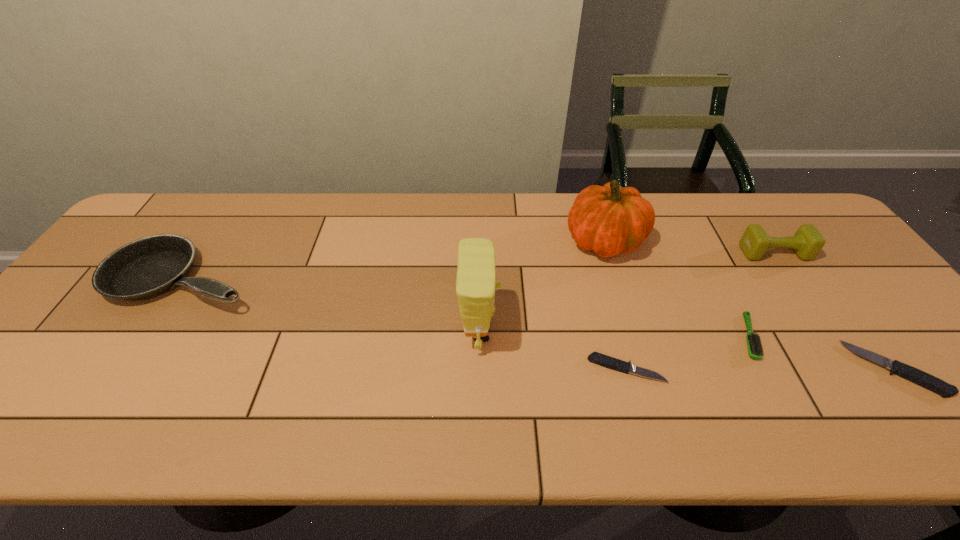
I want to click on free spot between the third object from right to left and the taller steak knife, so click(821, 353).

In order to click on unoccupied position between the pumpkin and the hairbrush in this screenshot , I will do `click(677, 289)`.

Locate an element on the screen. This screenshot has height=540, width=960. free space between the dumbbell and the hairbrush is located at coordinates (761, 295).

Locate an element on the screen. This screenshot has height=540, width=960. free space between the right steak knife and the fifth object from left to right is located at coordinates (821, 353).

The width and height of the screenshot is (960, 540). What are the coordinates of `vacant space in between the pumpkin and the fifth object from left to right` in the screenshot? It's located at (677, 289).

At what (x,y) coordinates should I click in order to perform the action: click on the closest object to the pumpkin. Please return your answer as a coordinate pair (x, y). Image resolution: width=960 pixels, height=540 pixels. Looking at the image, I should click on (754, 344).

This screenshot has width=960, height=540. Find the location of `object that stands as the fifth closest to the frying pan`. object that stands as the fifth closest to the frying pan is located at coordinates (807, 242).

Locate an element on the screen. This screenshot has width=960, height=540. free spot that satisfies the following two spatial constraints: 1. on the face of the left steak knife; 2. on the left side of the sponge is located at coordinates (480, 369).

Find the location of a particular element. The width and height of the screenshot is (960, 540). vacant space that satisfies the following two spatial constraints: 1. on the back side of the dumbbell; 2. on the right side of the frying pan is located at coordinates (202, 253).

Where is `vacant space that satisfies the following two spatial constraints: 1. on the face of the hairbrush; 2. on the right side of the sponge`? The height and width of the screenshot is (540, 960). vacant space that satisfies the following two spatial constraints: 1. on the face of the hairbrush; 2. on the right side of the sponge is located at coordinates (480, 337).